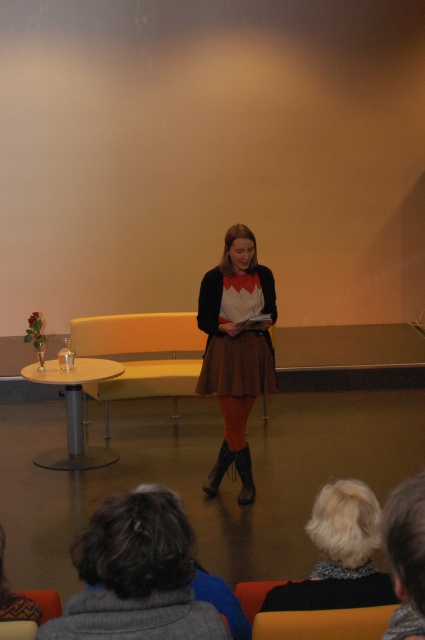
Is point (115, 497) farther from viewer compared to point (243, 225)?

No, it is in front of (243, 225).

I want to click on gray wool sweater at lower left, so click(136, 577).

Is gray wool sweater at lower left bigger than brown textured skirt at center?

Actually, gray wool sweater at lower left might be smaller than brown textured skirt at center.

This screenshot has height=640, width=425. Identify the location of gray wool sweater at lower left. (136, 577).

Can you confirm if gray wool sweater at lower left is thinner than fluffy gray sweater at lower center?

No.

Image resolution: width=425 pixels, height=640 pixels. Describe the element at coordinates (136, 577) in the screenshot. I see `gray wool sweater at lower left` at that location.

This screenshot has width=425, height=640. What are the coordinates of `gray wool sweater at lower left` in the screenshot? It's located at pos(136,577).